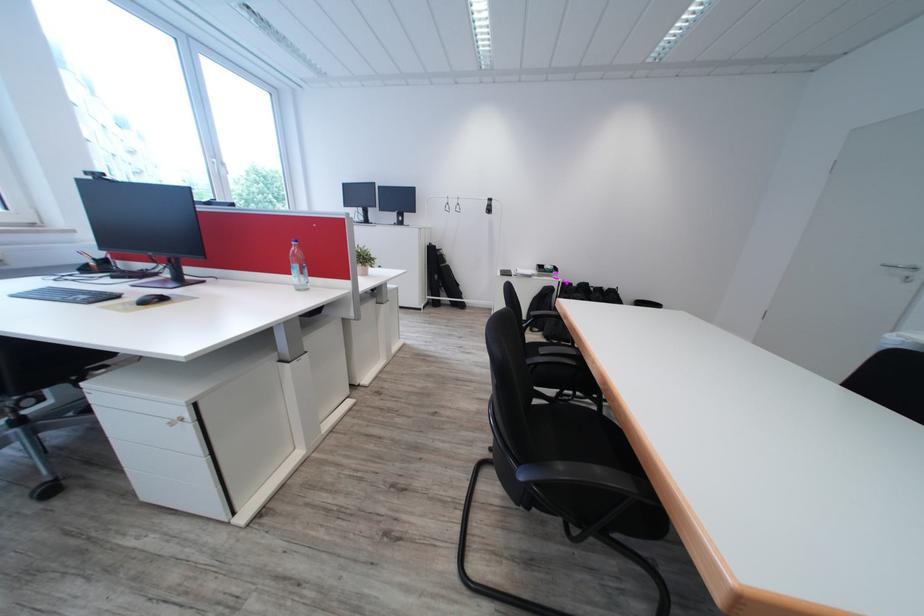
The height and width of the screenshot is (616, 924). In order to click on plastic water bottle in this screenshot , I will do (298, 267).